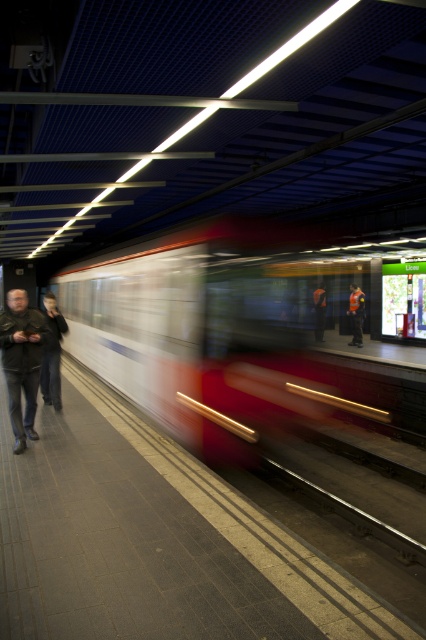
You are standing on the subway platform and see the smooth concrete platform at center and the dark gray jeans at left. Which object is closer to the edge of the platform?

The dark gray jeans at left are closer to the edge of the platform because the smooth concrete platform at center is to the right of the dark gray jeans at left, implying the jeans are positioned nearer to the edge.

You are waiting for the subway and notice two items on the platform floor near the tactile paving strip. The items are labeled as the leather jacket at left and the dark gray jeans at left. Which item is closer to the edge of the platform?

The leather jacket at left is above dark gray jeans at left, meaning it is positioned higher up and thus closer to the edge of the platform compared to the dark gray jeans at left.